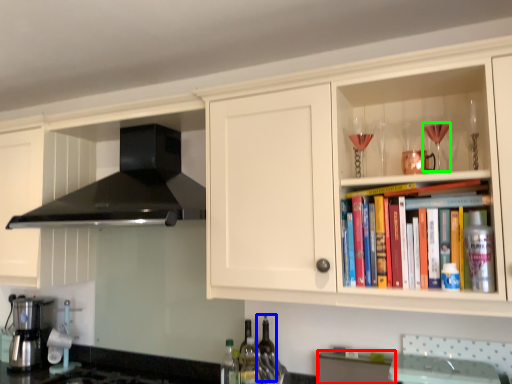
Question: Considering the real-world distances, which object is closest to cabinetry (highlighted by a red box)? bottle (highlighted by a blue box) or wine glass (highlighted by a green box).

Choices:
 (A) bottle
 (B) wine glass

Answer: (A)